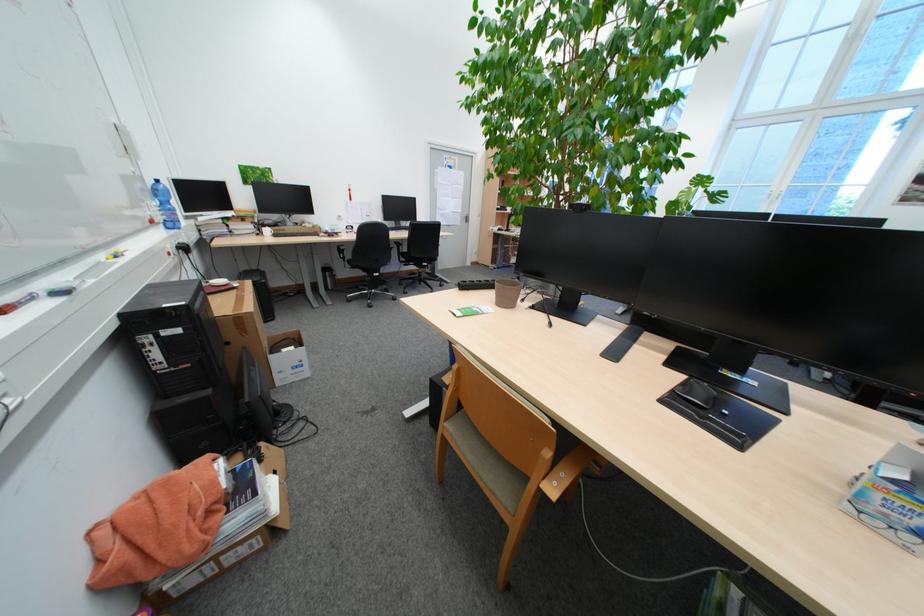
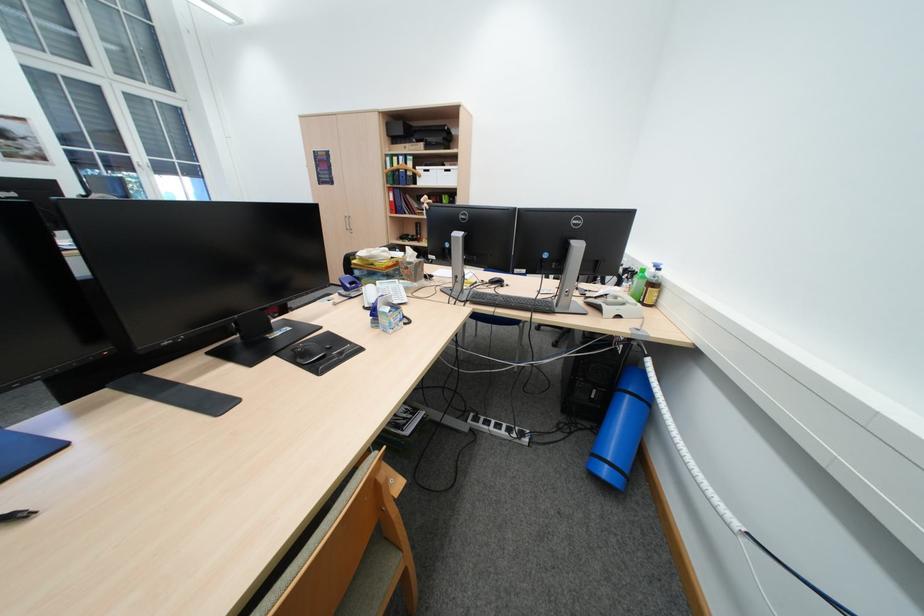
Where in the second image is the point corresponding to (872,496) from the first image?

(402, 325)